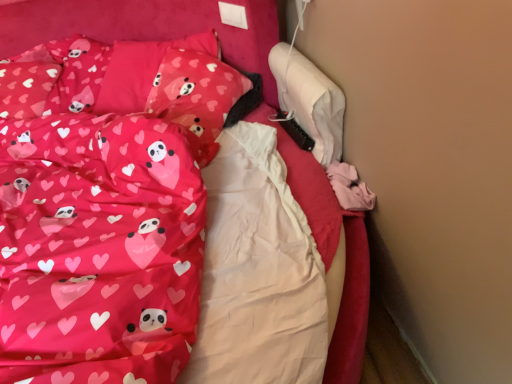
Question: Is matte pink pillow at upper left, marked as the second pillow in a front-to-back arrangement, inside matte pink fabric at left?

Choices:
 (A) yes
 (B) no

Answer: (B)

Question: Does matte pink fabric at left have a greater width compared to matte pink pillow at upper left, the 1th pillow in the back-to-front sequence?

Choices:
 (A) no
 (B) yes

Answer: (B)

Question: Does matte pink fabric at left have a lesser height compared to matte pink pillow at upper left, marked as the second pillow in a front-to-back arrangement?

Choices:
 (A) yes
 (B) no

Answer: (B)

Question: From the image's perspective, is matte pink fabric at left on top of matte pink pillow at upper left, marked as the second pillow in a front-to-back arrangement?

Choices:
 (A) yes
 (B) no

Answer: (B)

Question: Is matte pink fabric at left to the left of matte pink pillow at upper left, the 1th pillow in the back-to-front sequence, from the viewer's perspective?

Choices:
 (A) yes
 (B) no

Answer: (A)

Question: From the image's perspective, does matte pink fabric at left appear lower than matte pink pillow at upper left, the 1th pillow in the back-to-front sequence?

Choices:
 (A) no
 (B) yes

Answer: (B)

Question: Is matte pink pillow with heart and panda design at upper left, which is the first pillow in front-to-back order, aimed at matte pink fabric bed at center?

Choices:
 (A) no
 (B) yes

Answer: (B)

Question: Is matte pink fabric bed at center surrounded by matte pink pillow with heart and panda design at upper left, which is the first pillow in front-to-back order?

Choices:
 (A) yes
 (B) no

Answer: (B)

Question: From the image's perspective, is matte pink pillow with heart and panda design at upper left, arranged as the second pillow when viewed from the back, above matte pink fabric bed at center?

Choices:
 (A) yes
 (B) no

Answer: (A)

Question: Is matte pink pillow with heart and panda design at upper left, which is the first pillow in front-to-back order, placed right next to matte pink fabric bed at center?

Choices:
 (A) yes
 (B) no

Answer: (B)

Question: Can you confirm if matte pink pillow with heart and panda design at upper left, which is the first pillow in front-to-back order, is smaller than matte pink fabric bed at center?

Choices:
 (A) yes
 (B) no

Answer: (A)

Question: Does matte pink pillow with heart and panda design at upper left, arranged as the second pillow when viewed from the back, have a greater width compared to matte pink fabric bed at center?

Choices:
 (A) yes
 (B) no

Answer: (B)

Question: Is matte pink fabric at left at the back of matte pink pillow at upper left, the 1th pillow in the back-to-front sequence?

Choices:
 (A) no
 (B) yes

Answer: (A)